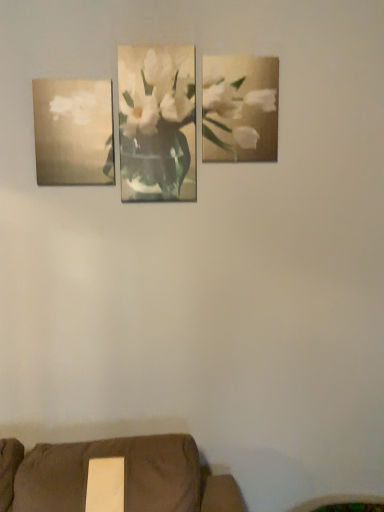
Question: Is matte gold painting at left, the second picture frame when ordered from right to left, positioned beyond the bounds of metallic gold painting at upper right, the 2th picture frame when ordered from left to right?

Choices:
 (A) yes
 (B) no

Answer: (A)

Question: From a real-world perspective, is matte gold painting at left, the 1th picture frame viewed from the left, on metallic gold painting at upper right, the first picture frame from the right?

Choices:
 (A) no
 (B) yes

Answer: (A)

Question: Does matte gold painting at left, the 1th picture frame viewed from the left, have a larger size compared to metallic gold painting at upper right, the first picture frame from the right?

Choices:
 (A) no
 (B) yes

Answer: (B)

Question: Is matte gold painting at left, the 1th picture frame viewed from the left, thinner than metallic gold painting at upper right, the first picture frame from the right?

Choices:
 (A) yes
 (B) no

Answer: (B)

Question: Are matte gold painting at left, the second picture frame when ordered from right to left, and metallic gold painting at upper right, the first picture frame from the right, located far from each other?

Choices:
 (A) yes
 (B) no

Answer: (B)

Question: In terms of height, does matte gold painting at left, the 1th picture frame viewed from the left, look taller or shorter compared to metallic gold painting at upper right, the 2th picture frame when ordered from left to right?

Choices:
 (A) tall
 (B) short

Answer: (B)

Question: Considering their positions, is matte gold painting at left, the 1th picture frame viewed from the left, located in front of or behind metallic gold painting at upper right, the 2th picture frame when ordered from left to right?

Choices:
 (A) front
 (B) behind

Answer: (A)

Question: Based on their positions, is matte gold painting at left, the 1th picture frame viewed from the left, located to the left or right of metallic gold painting at upper right, the first picture frame from the right?

Choices:
 (A) right
 (B) left

Answer: (B)

Question: Is matte gold painting at left, the second picture frame when ordered from right to left, wider or thinner than metallic gold painting at upper right, the 2th picture frame when ordered from left to right?

Choices:
 (A) wide
 (B) thin

Answer: (A)

Question: In terms of width, does white matte flower at center look wider or thinner when compared to matte gold painting at left, the second picture frame when ordered from right to left?

Choices:
 (A) wide
 (B) thin

Answer: (B)

Question: From the image's perspective, is white matte flower at center positioned above or below matte gold painting at left, the second picture frame when ordered from right to left?

Choices:
 (A) above
 (B) below

Answer: (A)

Question: Is point (193, 57) closer or farther from the camera than point (76, 154)?

Choices:
 (A) closer
 (B) farther

Answer: (B)

Question: Is white matte flower at center to the left or to the right of matte gold painting at left, the 1th picture frame viewed from the left, in the image?

Choices:
 (A) right
 (B) left

Answer: (A)

Question: In the image, is metallic gold painting at upper right, the 2th picture frame when ordered from left to right, positioned in front of or behind matte gold painting at left, the second picture frame when ordered from right to left?

Choices:
 (A) behind
 (B) front

Answer: (A)

Question: Do you think metallic gold painting at upper right, the first picture frame from the right, is within matte gold painting at left, the 1th picture frame viewed from the left, or outside of it?

Choices:
 (A) inside
 (B) outside

Answer: (B)